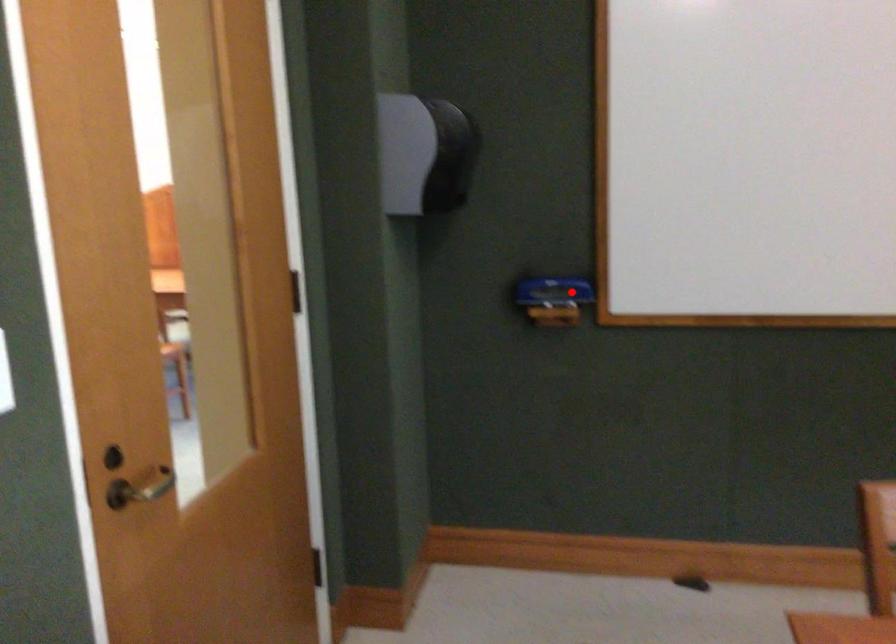
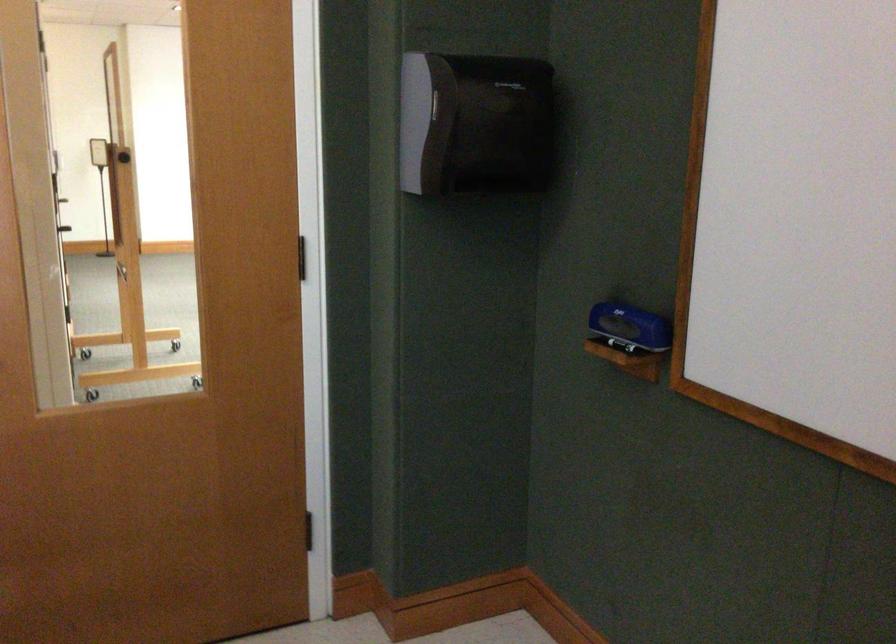
Find the pixel in the second image that matches the highlighted location in the first image.

(630, 327)